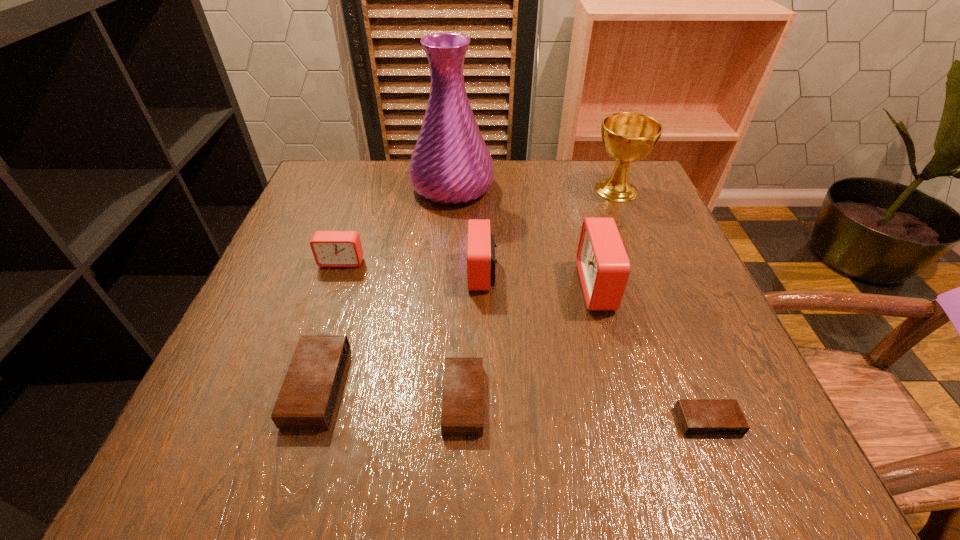
Find the location of `alarm clock present at the right edge`. alarm clock present at the right edge is located at coordinates (696, 416).

The width and height of the screenshot is (960, 540). I want to click on object positioned at the near left corner, so click(307, 399).

Find the location of a particular element. Image resolution: width=960 pixels, height=540 pixels. object that is positioned at the far right corner is located at coordinates (627, 137).

Locate an element on the screen. The image size is (960, 540). object at the near right corner is located at coordinates (696, 416).

The image size is (960, 540). In the image, there is a desktop. Identify the location of vacant area at the far edge. (541, 184).

You are a GUI agent. You are given a task and a screenshot of the screen. Output one action in this format:
    pyautogui.click(x=<x>, y=<y>)
    Task: Click on the vacant region at the left edge
    This screenshot has height=540, width=960.
    Given the screenshot: What is the action you would take?
    pyautogui.click(x=228, y=350)

Locate an element on the screen. free space at the right edge of the desktop is located at coordinates (668, 285).

In the image, there is a desktop. What are the coordinates of `free region at the far left corner` in the screenshot? It's located at (372, 181).

In the image, there is a desktop. In order to click on vacant region at the near left corner in this screenshot , I will do `click(181, 433)`.

The width and height of the screenshot is (960, 540). What are the coordinates of `vacant space at the far right corner of the desktop` in the screenshot? It's located at (588, 176).